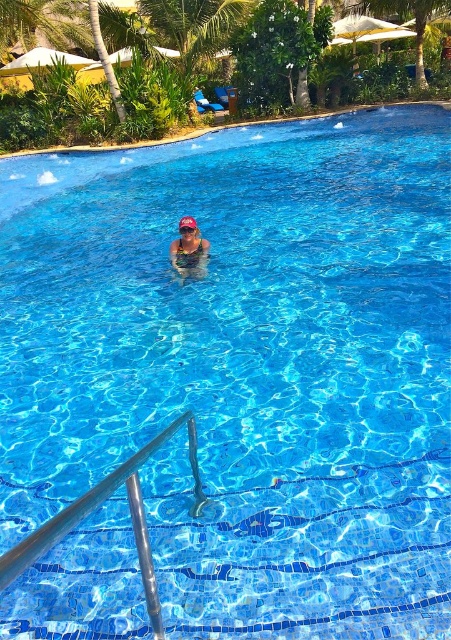
In the scene shown: Is silver metallic rail at lower left taller than transparent plastic goggles at center?

Correct, silver metallic rail at lower left is much taller as transparent plastic goggles at center.

Which is above, silver metallic rail at lower left or transparent plastic goggles at center?

transparent plastic goggles at center

Identify the location of silver metallic rail at lower left. Image resolution: width=451 pixels, height=640 pixels. (100, 504).

At what (x,y) coordinates should I click in order to perform the action: click on silver metallic rail at lower left. Please return your answer as a coordinate pair (x, y). Image resolution: width=451 pixels, height=640 pixels. Looking at the image, I should click on (100, 504).

Between matte blue swimsuit at center and transparent plastic goggles at center, which one is positioned lower?

matte blue swimsuit at center is below.

Does point (184, 262) lie behind point (189, 228)?

Yes, point (184, 262) is farther from viewer.

Between point (184, 259) and point (184, 228), which one is positioned behind?

The point (184, 259) is more distant.

I want to click on matte blue swimsuit at center, so click(188, 250).

Describe the element at coordinates (100, 504) in the screenshot. I see `silver metallic rail at lower left` at that location.

Can you confirm if silver metallic rail at lower left is smaller than matte blue swimsuit at center?

Actually, silver metallic rail at lower left might be larger than matte blue swimsuit at center.

Does point (159, 436) lie in front of point (192, 260)?

That is True.

Image resolution: width=451 pixels, height=640 pixels. I want to click on silver metallic rail at lower left, so click(100, 504).